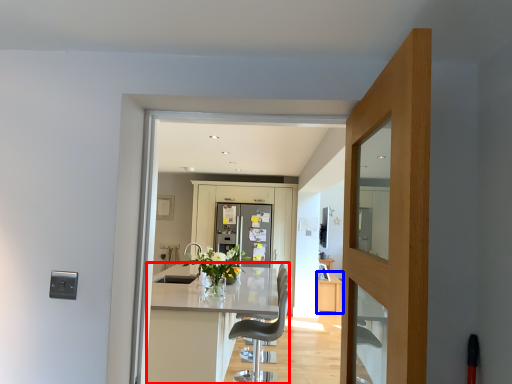
Question: Which point is further to the camera, kitchen & dining room table (highlighted by a red box) or cabinetry (highlighted by a blue box)?

Choices:
 (A) kitchen & dining room table
 (B) cabinetry

Answer: (B)